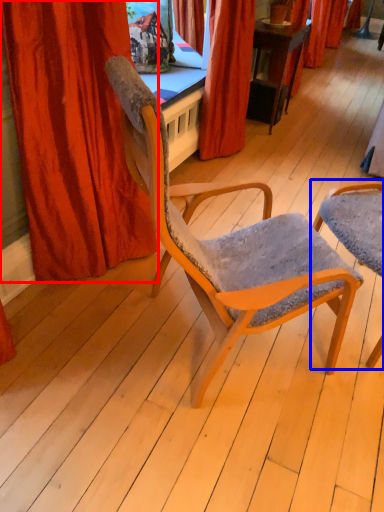
Question: Which of the following is the closest to the observer, curtain (highlighted by a red box) or chair (highlighted by a blue box)?

Choices:
 (A) curtain
 (B) chair

Answer: (A)